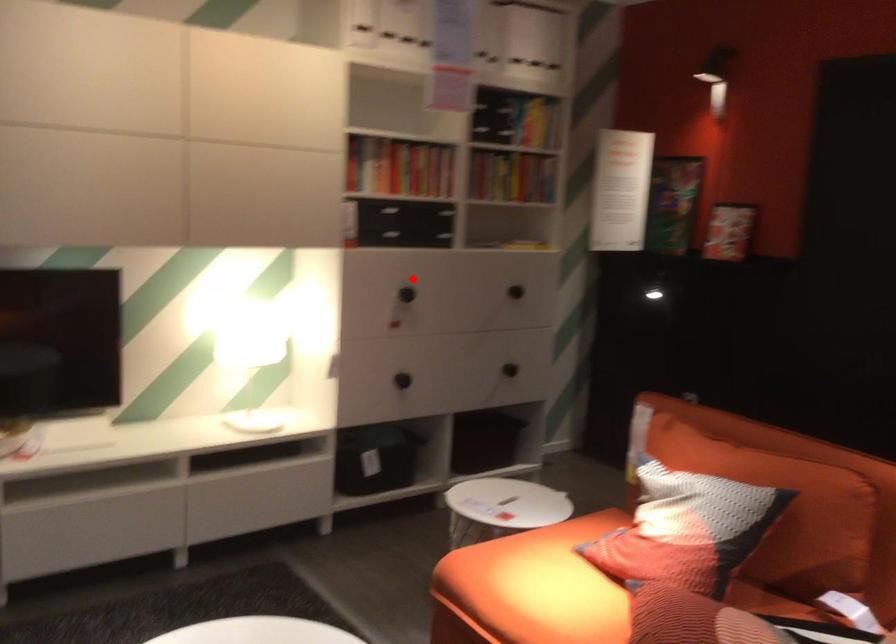
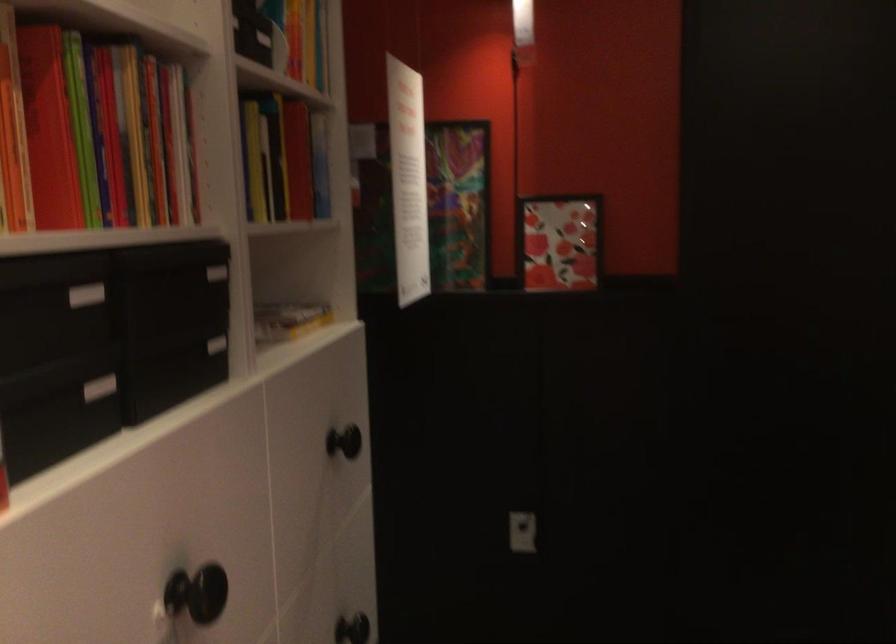
Question: A red point is marked in image1. In image2, is the corresponding 3D point closer to the camera or farther? Reply with the corresponding letter.

Choices:
 (A) The corresponding 3D point is closer.
 (B) The corresponding 3D point is farther.

Answer: (A)